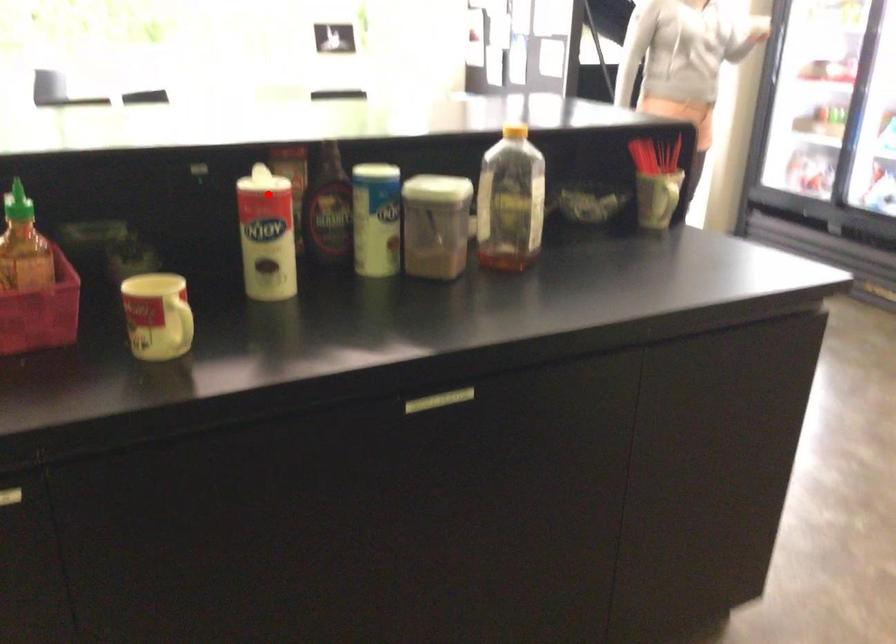
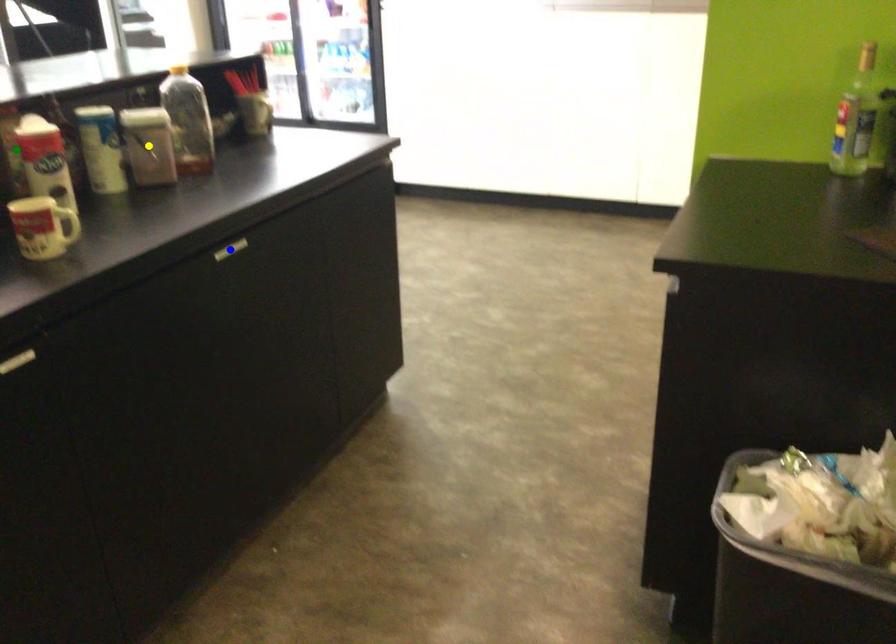
Question: I am providing you with two images of the same scene from different viewpoints. A red point is marked on the first image. You are given multiple points on the second image. In image 2, which mark is for the same physical point as the one in image 1?

Choices:
 (A) green point
 (B) blue point
 (C) yellow point

Answer: (A)